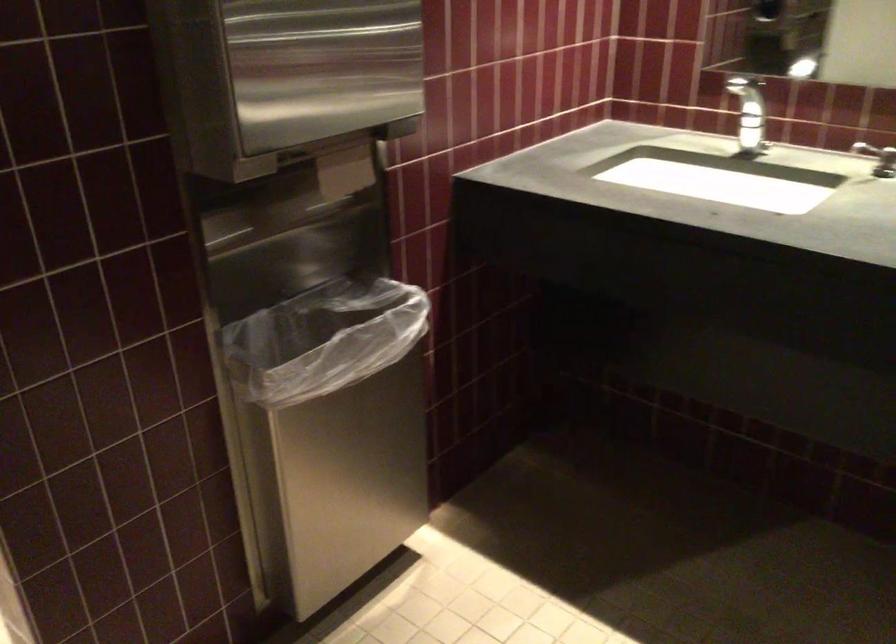
Find where to plac the trash can opening. Please return your answer as a coordinate pair (x, y).

(326, 315)